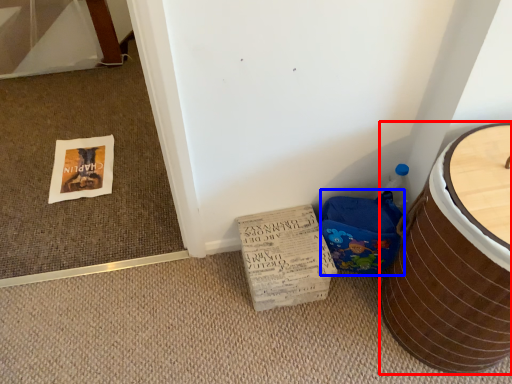
Question: Which of the following is the farthest to the observer, furniture (highlighted by a red box) or potty (highlighted by a blue box)?

Choices:
 (A) furniture
 (B) potty

Answer: (B)